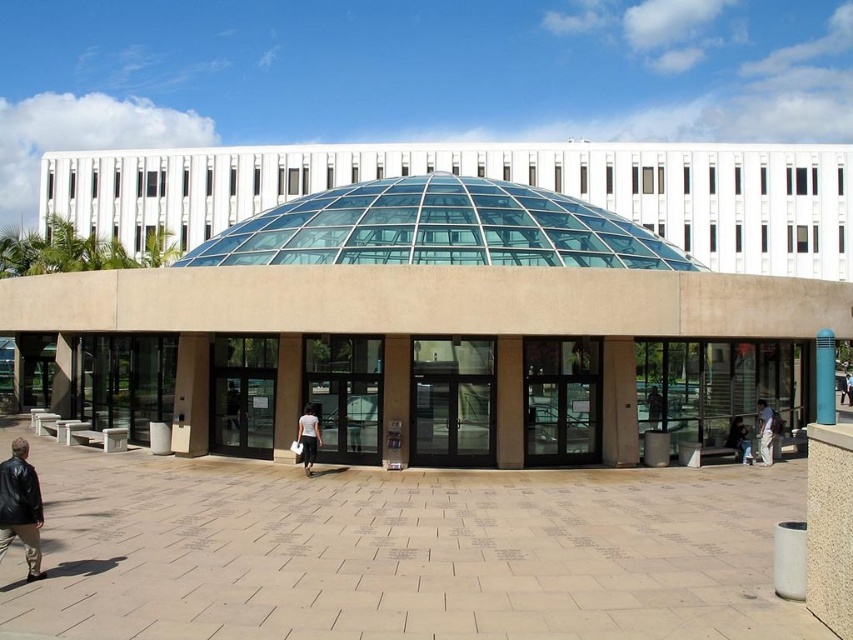
You are standing in the plaza in front of the building and want to take a photo of both the transparent glass dome at center and the blue glossy pillar at center. Which object should you focus on first to ensure both are in the frame?

You should focus on the transparent glass dome at center first because it is closer to you than the blue glossy pillar at center, so by focusing on it, both objects will be in focus.

You are standing in the plaza in front of the building and want to walk to the point that is closer to the camera. Which point should you head towards, point (310,432) or point (735,432)?

You should head towards point (310,432) because it is closer to the camera than point (735,432).

You are standing at the entrance of the building and see the leather jacket at lower left and the blue glossy pillar at center. Which object is narrower?

The leather jacket at lower left is narrower than the blue glossy pillar at center.